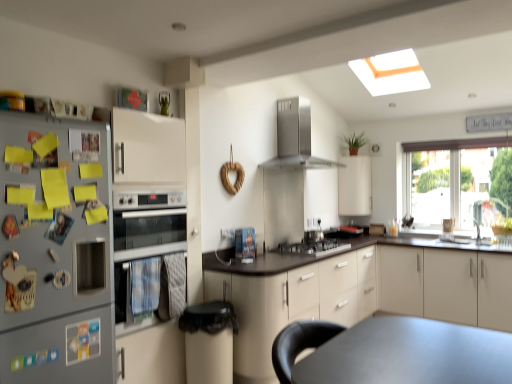
Question: In terms of width, does satin silver cooktop at center look wider or thinner when compared to beige matte cabinet at right, the first cabinetry positioned from the right?

Choices:
 (A) thin
 (B) wide

Answer: (A)

Question: Is satin silver cooktop at center taller or shorter than beige matte cabinet at right, the first cabinetry positioned from the right?

Choices:
 (A) tall
 (B) short

Answer: (B)

Question: Based on their relative distances, which object is farther from the stainless steel range hood at upper center?

Choices:
 (A) satin silver cooktop at center
 (B) beige matte cabinet at center, acting as the third cabinetry starting from the right
 (C) silver metallic oven at left
 (D) beige matte cabinet at right, the first cabinetry positioned from the right
 (E) transparent glass window at right

Answer: (E)

Question: Which object is positioned farthest from the silver metallic refrigerator at left?

Choices:
 (A) beige matte cabinet at center, the 1th cabinetry from the left
 (B) transparent glass window at right
 (C) satin silver gas stove at center
 (D) satin silver cooktop at center
 (E) stainless steel range hood at upper center

Answer: (B)